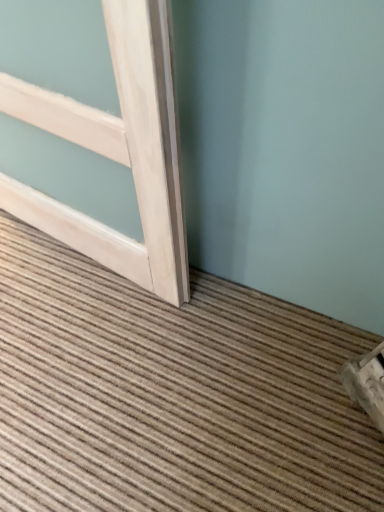
Measure the distance between brown striped carpet at lower left and camera.

brown striped carpet at lower left and camera are 86.72 centimeters apart from each other.

Describe the element at coordinates (171, 394) in the screenshot. I see `brown striped carpet at lower left` at that location.

Identify the location of brown striped carpet at lower left. The width and height of the screenshot is (384, 512). pos(171,394).

This screenshot has height=512, width=384. In order to click on brown striped carpet at lower left in this screenshot , I will do `click(171, 394)`.